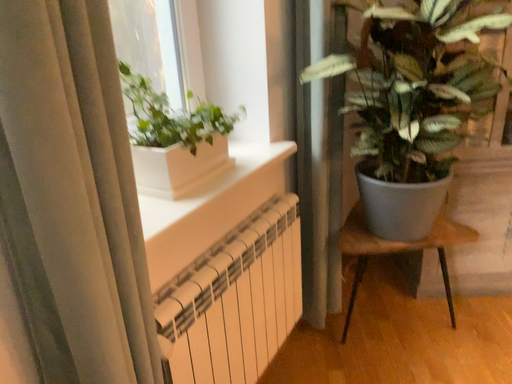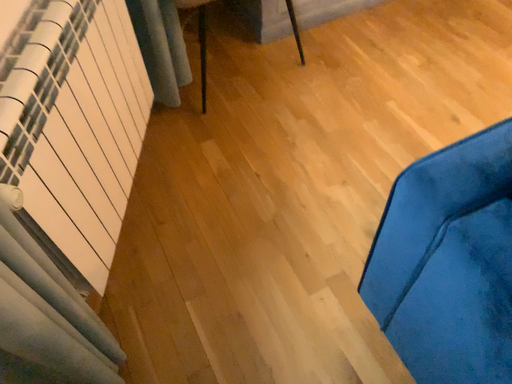
Question: How did the camera likely rotate when shooting the video?

Choices:
 (A) rotated upward
 (B) rotated downward

Answer: (B)